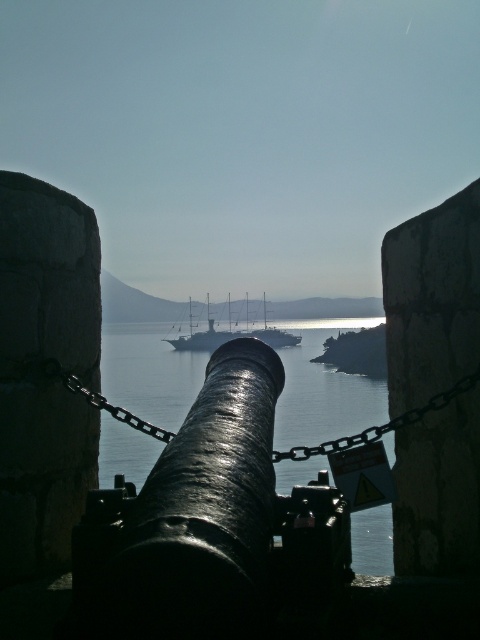
Question: Can you confirm if black metal chain at center is positioned to the left of shiny silver ship at center?

Choices:
 (A) yes
 (B) no

Answer: (B)

Question: Which point is closer to the camera?

Choices:
 (A) smooth blue water at center
 (B) shiny silver ship at center
 (C) glossy water at cannon center
 (D) black metal chain at center

Answer: (C)

Question: Among these objects, which one is farthest from the camera?

Choices:
 (A) shiny silver ship at center
 (B) glossy water at cannon center
 (C) black metal chain at center
 (D) smooth blue water at center

Answer: (D)

Question: Can you confirm if glossy water at cannon center is positioned above black metal chain at center?

Choices:
 (A) no
 (B) yes

Answer: (A)

Question: Does smooth blue water at center have a greater width compared to black metal chain at center?

Choices:
 (A) yes
 (B) no

Answer: (A)

Question: Which of these objects is positioned farthest from the smooth blue water at center?

Choices:
 (A) black metal chain at center
 (B) shiny silver ship at center

Answer: (A)